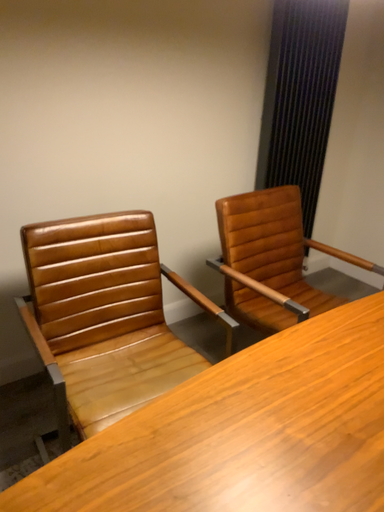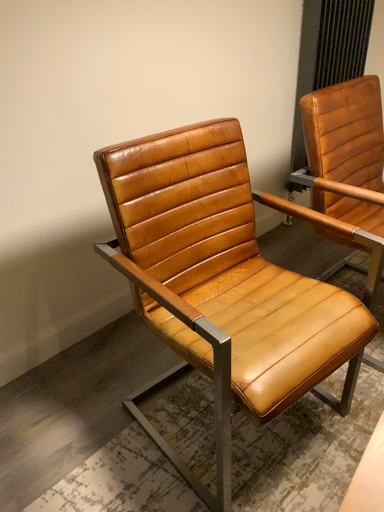
Question: How did the camera likely rotate when shooting the video?

Choices:
 (A) rotated downward
 (B) rotated upward

Answer: (A)